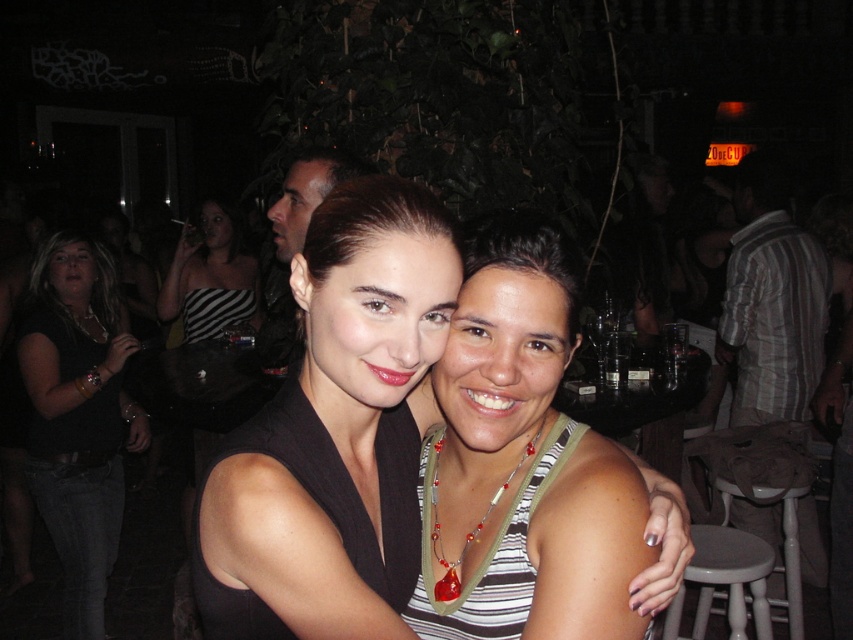
Does black matte dress at center appear on the left side of translucent green lanyard at center?

Indeed, black matte dress at center is positioned on the left side of translucent green lanyard at center.

From the picture: Can you confirm if black matte dress at center is positioned below translucent green lanyard at center?

Incorrect, black matte dress at center is not positioned below translucent green lanyard at center.

Find the location of a particular element. black matte dress at center is located at coordinates (335, 433).

Is the position of black matte dress at center less distant than that of black matte dress at left?

Yes, black matte dress at center is in front of black matte dress at left.

Does black matte dress at center appear under black matte dress at left?

No, black matte dress at center is not below black matte dress at left.

Find the location of a particular element. This screenshot has width=853, height=640. black matte dress at center is located at coordinates (335, 433).

Where is `black matte dress at center`? The width and height of the screenshot is (853, 640). black matte dress at center is located at coordinates (335, 433).

Is black matte dress at left to the right of striped fabric dress at center from the viewer's perspective?

No, black matte dress at left is not to the right of striped fabric dress at center.

Is black matte dress at left taller than striped fabric dress at center?

Yes.

Find the location of `black matte dress at left`. black matte dress at left is located at coordinates (78, 416).